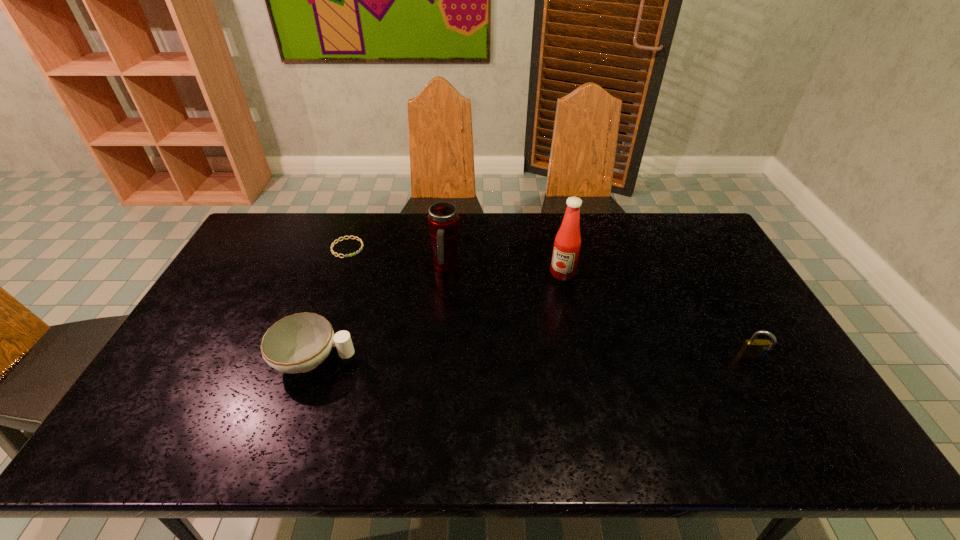
The width and height of the screenshot is (960, 540). I want to click on free space on the desktop that is between the chinaware and the rightmost object and is positioned on the side with the handle of the third object from right to left, so click(540, 359).

Locate an element on the screen. free spot on the desktop that is between the second shortest object and the rightmost object and is positioned on the surface of the bracelet showing star-shaped elements is located at coordinates (468, 360).

Find the location of a particular element. The height and width of the screenshot is (540, 960). free space on the desktop that is between the second shortest object and the padlock and is positioned on the front-facing side of the second object from right to left is located at coordinates (509, 360).